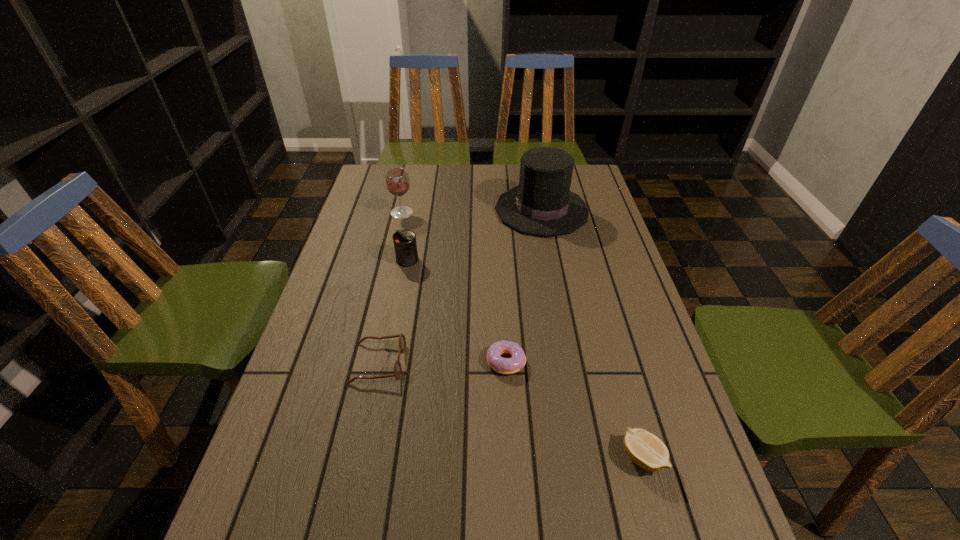
The width and height of the screenshot is (960, 540). In order to click on the tallest object in this screenshot , I will do `click(543, 205)`.

Find the location of a particular element. Image resolution: width=960 pixels, height=540 pixels. the second tallest object is located at coordinates (397, 181).

The image size is (960, 540). What are the coordinates of `the third tallest object` in the screenshot? It's located at (405, 246).

Identify the location of can. This screenshot has width=960, height=540. (405, 246).

Locate an element on the screen. This screenshot has height=540, width=960. spectacles is located at coordinates (402, 341).

Find the location of a particular element. the nearest object is located at coordinates (645, 449).

Locate an element on the screen. Image resolution: width=960 pixels, height=540 pixels. doughnut is located at coordinates (507, 366).

Locate an element on the screen. vacant space positioned on the front of the dress hat with the decoration is located at coordinates (429, 210).

Locate an element on the screen. vacant region located 0.090m on the front of the dress hat with the decoration is located at coordinates (469, 210).

Locate an element on the screen. free location located 0.070m on the front of the dress hat with the decoration is located at coordinates (475, 210).